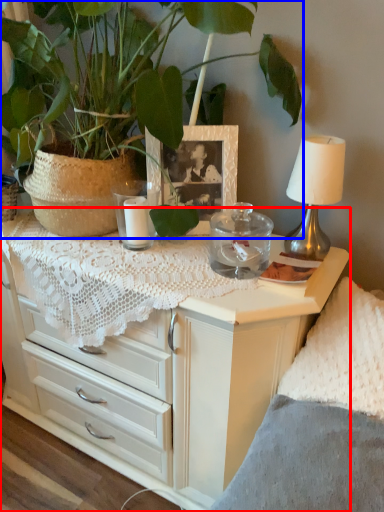
Question: Which object is further to the camera taking this photo, chest of drawers (highlighted by a red box) or houseplant (highlighted by a blue box)?

Choices:
 (A) chest of drawers
 (B) houseplant

Answer: (A)